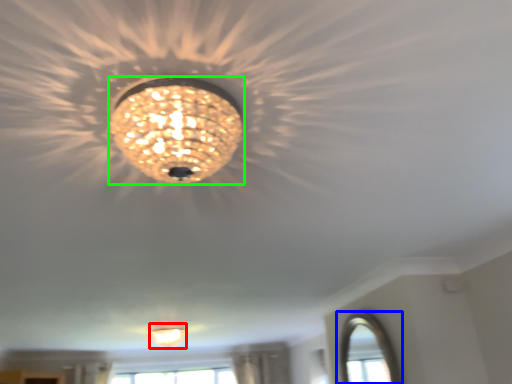
Question: Estimate the real-world distances between objects in this image. Which object is closer to lamp (highlighted by a red box), window (highlighted by a blue box) or lamp (highlighted by a green box)?

Choices:
 (A) window
 (B) lamp

Answer: (A)